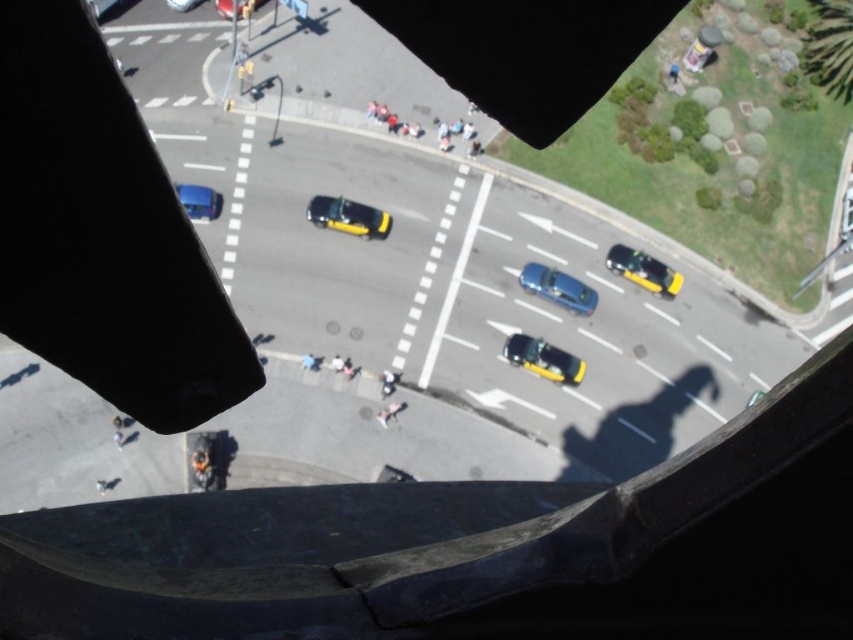
Question: Which point is farther from the camera taking this photo?

Choices:
 (A) (665, 280)
 (B) (527, 348)
 (C) (200, 200)

Answer: (A)

Question: Is metallic blue car at upper left positioned at the back of smooth skin person at center?

Choices:
 (A) no
 (B) yes

Answer: (A)

Question: Which of the following is the farthest from the observer?

Choices:
 (A) blue fabric person at center
 (B) smooth skin person at center

Answer: (A)

Question: Does shiny black taxi at center appear on the right side of metallic blue car at center?

Choices:
 (A) yes
 (B) no

Answer: (B)

Question: Which object is the closest to the metallic blue car at center?

Choices:
 (A) smooth skin person at center
 (B) yellow metallic taxi at lower right
 (C) white fabric person at center

Answer: (B)

Question: Can you confirm if shiny black taxi at center is wider than white fabric person at center?

Choices:
 (A) yes
 (B) no

Answer: (A)